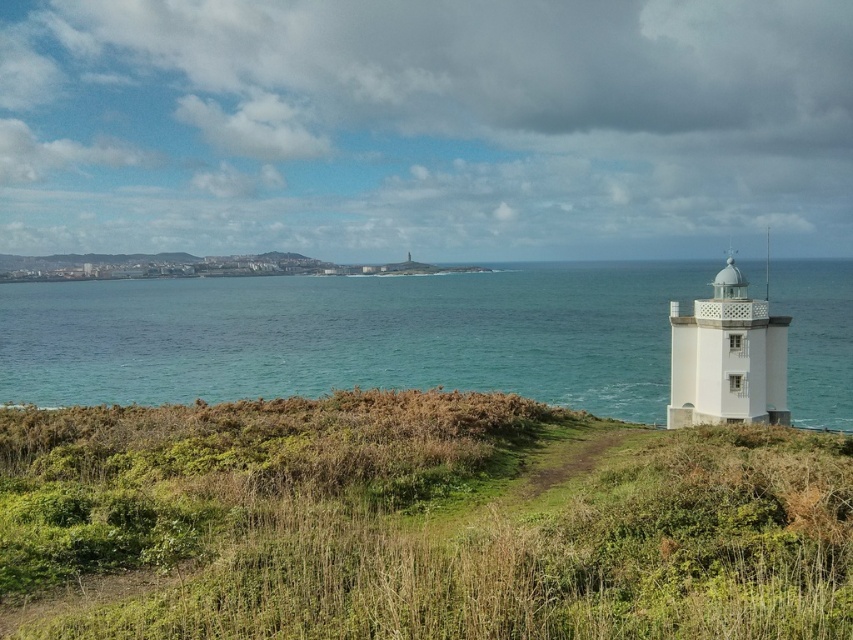
Based on the photo, which is above, green grassy at right or white matte lighthouse at right?

white matte lighthouse at right

Can you confirm if green grassy at right is thinner than white matte lighthouse at right?

No, green grassy at right is not thinner than white matte lighthouse at right.

Does point (431, 593) come farther from viewer compared to point (721, 406)?

No, it is in front of (721, 406).

I want to click on green grassy at right, so click(416, 522).

Which is in front, point (357, 440) or point (502, 390)?

Point (357, 440) is in front.

Who is positioned more to the right, green grassy at right or blue water at center?

From the viewer's perspective, blue water at center appears more on the right side.

Locate an element on the screen. The image size is (853, 640). green grassy at right is located at coordinates (416, 522).

Who is positioned more to the right, blue water at center or white matte lighthouse at right?

Positioned to the right is white matte lighthouse at right.

This screenshot has height=640, width=853. What do you see at coordinates (352, 336) in the screenshot?
I see `blue water at center` at bounding box center [352, 336].

Locate an element on the screen. The image size is (853, 640). blue water at center is located at coordinates (352, 336).